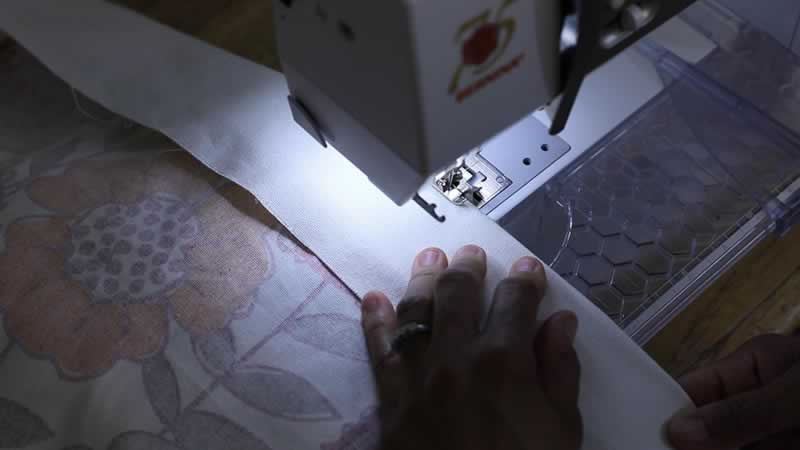
Identify the location of bobbin cover. The width and height of the screenshot is (800, 450). (490, 174).